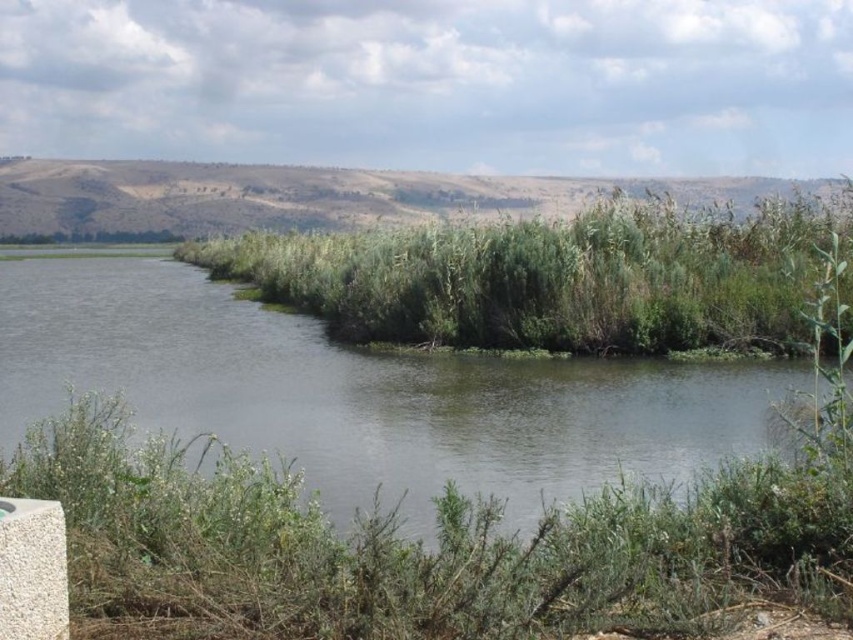
Question: Is green leafy shrubs at lower center to the left of green grassy river at center from the viewer's perspective?

Choices:
 (A) no
 (B) yes

Answer: (A)

Question: Where is green leafy shrubs at lower center located in relation to green leafy reeds at center in the image?

Choices:
 (A) right
 (B) left

Answer: (A)

Question: Is green leafy shrubs at lower center thinner than green grassy river at center?

Choices:
 (A) yes
 (B) no

Answer: (A)

Question: Which point is farther to the camera?

Choices:
 (A) (408, 628)
 (B) (596, 266)

Answer: (B)

Question: Which of the following is the farthest from the observer?

Choices:
 (A) green leafy shrubs at lower center
 (B) green leafy reeds at center
 (C) green grassy river at center

Answer: (B)

Question: Which object is positioned closest to the green grassy river at center?

Choices:
 (A) green leafy shrubs at lower center
 (B) green leafy reeds at center

Answer: (B)